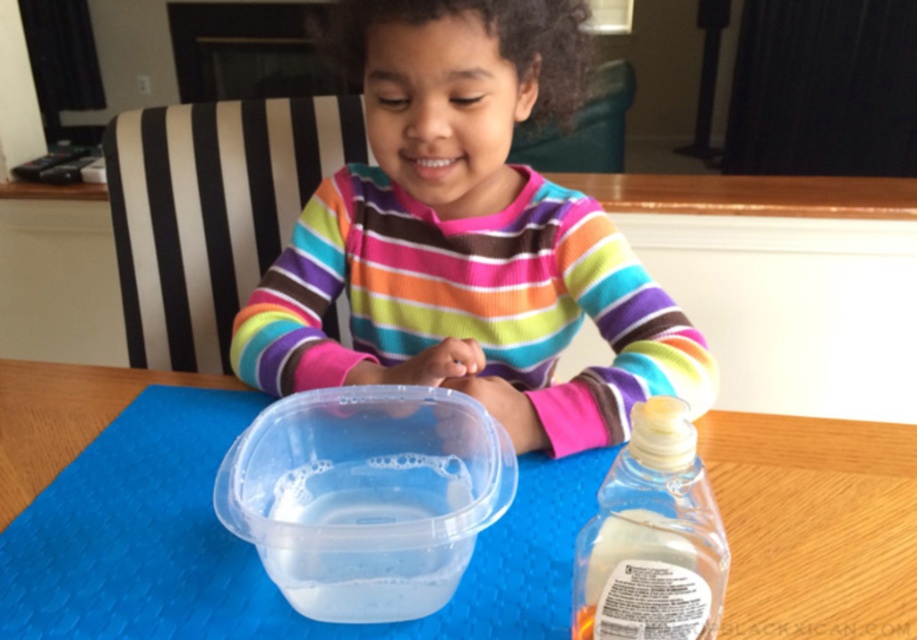
Consider the image. You are a parent trying to locate the soap bottle for your child. The child is sitting at the table and you see the point at coordinates (652, 538). Where is the translucent plastic bottle at lower right in relation to this point?

The point at coordinates (652, 538) is on the translucent plastic bottle at lower right, so the bottle is located exactly where the point is marked.

Looking at this image, you are standing at the point with coordinates point [874,438] and want to move to the point with coordinates point [269,326]. Which direction should you move in to reach your destination?

You should move towards the direction opposite to where point [874,438] is located, as point [269,326] is behind point [874,438].

Consider the image. You are a parent trying to clean up after your child. You need to put away the translucent plastic bottle at lower right and the transparent plastic water at center. Which object should you place first if you want to start with the smaller one?

The translucent plastic bottle at lower right is smaller than the transparent plastic water at center, so you should place the translucent plastic bottle at lower right first.